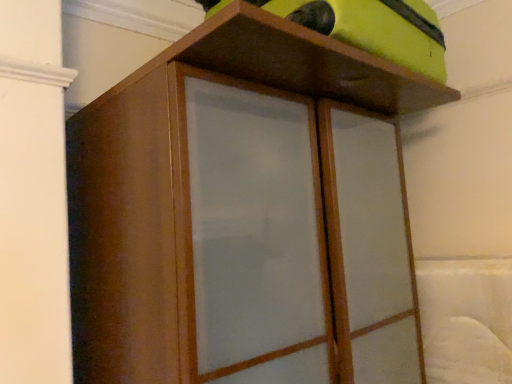
The height and width of the screenshot is (384, 512). Describe the element at coordinates (300, 60) in the screenshot. I see `wooden shelf at upper center` at that location.

You are a GUI agent. You are given a task and a screenshot of the screen. Output one action in this format:
    pyautogui.click(x=<x>, y=<y>)
    Task: Click on the wooden shelf at upper center
    
    Given the screenshot: What is the action you would take?
    pyautogui.click(x=300, y=60)

Locate an element on the screen. The width and height of the screenshot is (512, 384). wooden shelf at upper center is located at coordinates (300, 60).